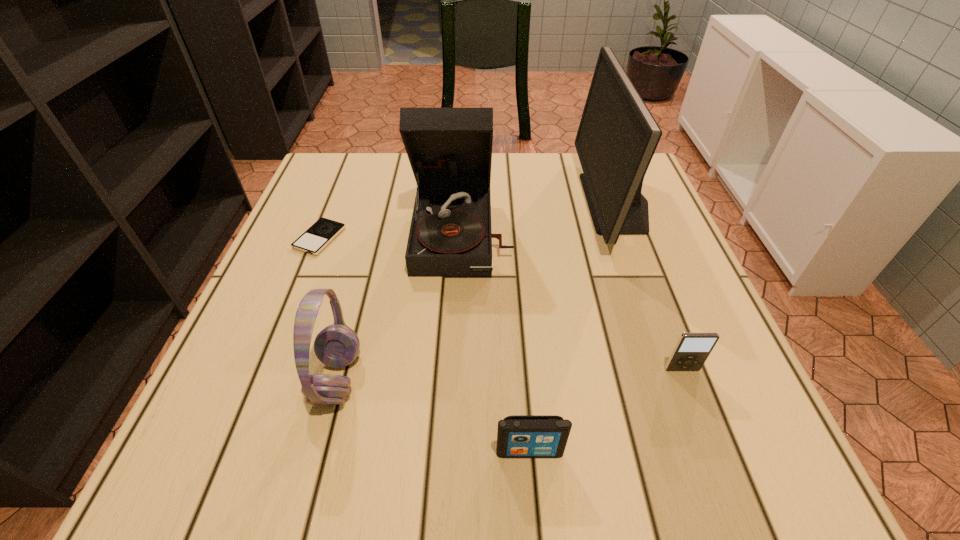
The image size is (960, 540). I want to click on vacant space situated 0.220m on the screen side of the computer monitor, so click(x=495, y=202).

Image resolution: width=960 pixels, height=540 pixels. In order to click on vacant position located 0.190m on the screen side of the computer monitor in this screenshot , I will do `click(508, 202)`.

In order to click on free region located 0.180m on the front-facing side of the phonograph_record in this screenshot , I will do click(458, 349).

You are a GUI agent. You are given a task and a screenshot of the screen. Output one action in this format:
    pyautogui.click(x=<x>, y=<y>)
    Task: Click on the vacant space located on the headband and ear cups of the headset
    
    Given the screenshot: What is the action you would take?
    pyautogui.click(x=533, y=378)

I want to click on vacant space located on the front-facing side of the rightmost iPod, so click(x=711, y=447).

You are a GUI agent. You are given a task and a screenshot of the screen. Output one action in this format:
    pyautogui.click(x=<x>, y=<y>)
    Task: Click on the vacant space situated on the front of the shortest object
    This screenshot has width=960, height=540.
    Given the screenshot: What is the action you would take?
    288,317

The width and height of the screenshot is (960, 540). Find the location of `computer monitor present at the far edge`. computer monitor present at the far edge is located at coordinates (617, 137).

At what (x,y) coordinates should I click in order to perform the action: click on phonograph_record situated at the far edge. Please return your answer as a coordinate pair (x, y). This screenshot has width=960, height=540. Looking at the image, I should click on 449,149.

The image size is (960, 540). Identify the location of object located in the near edge section of the desktop. (518, 436).

Where is `headset that is at the left edge`? Image resolution: width=960 pixels, height=540 pixels. headset that is at the left edge is located at coordinates (337, 345).